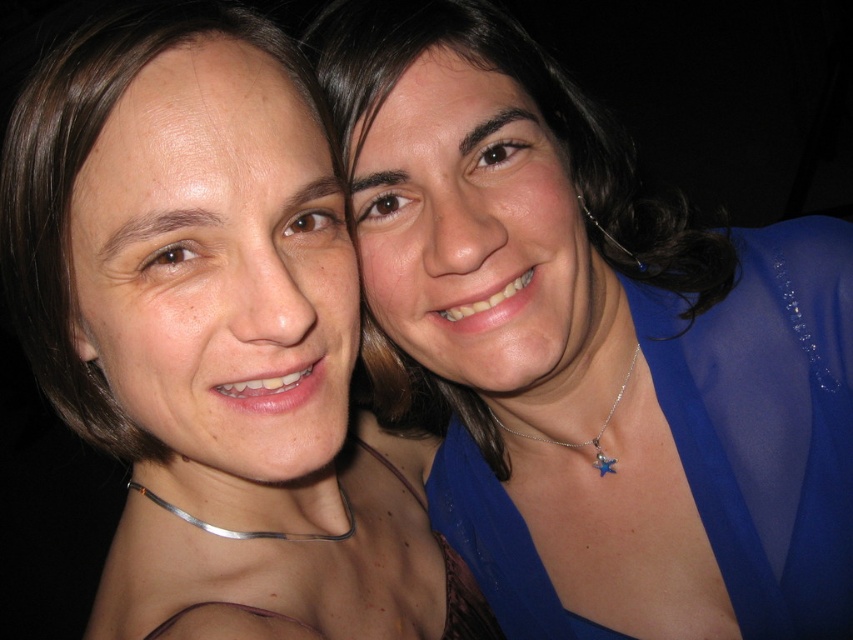
Can you confirm if blue satin blouse at upper right is positioned below blue satin dress at right?

No, blue satin blouse at upper right is not below blue satin dress at right.

Measure the distance between point (68, 44) and camera.

Point (68, 44) is 18.92 inches from camera.

At what (x,y) coordinates should I click in order to perform the action: click on blue satin blouse at upper right. Please return your answer as a coordinate pair (x, y). The height and width of the screenshot is (640, 853). Looking at the image, I should click on (213, 339).

Does blue satin blouse at upper right have a lesser height compared to matte blue blouse at right?

No, blue satin blouse at upper right is not shorter than matte blue blouse at right.

The height and width of the screenshot is (640, 853). What do you see at coordinates (213, 339) in the screenshot?
I see `blue satin blouse at upper right` at bounding box center [213, 339].

Measure the distance between blue satin blouse at upper right and camera.

blue satin blouse at upper right is 16.10 inches away from camera.

Find the location of `blue satin blouse at upper right`. blue satin blouse at upper right is located at coordinates (213, 339).

Is blue satin dress at right positioned before matte blue blouse at right?

No.

Is blue satin dress at right taller than matte blue blouse at right?

No, blue satin dress at right is not taller than matte blue blouse at right.

What do you see at coordinates (767, 422) in the screenshot? I see `blue satin dress at right` at bounding box center [767, 422].

The image size is (853, 640). I want to click on blue satin dress at right, so click(767, 422).